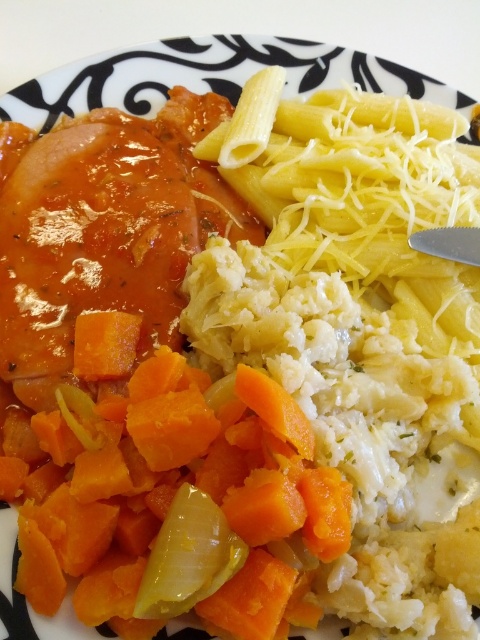
Question: Which point is farther to the camera?

Choices:
 (A) (213, 525)
 (B) (264, 589)

Answer: (A)

Question: From the image, what is the correct spatial relationship of orange smooth carrot at left in relation to yellow translucent onion at lower center?

Choices:
 (A) above
 (B) below

Answer: (A)

Question: In this image, where is orange smooth carrot at left located relative to yellow translucent onion at lower center?

Choices:
 (A) left
 (B) right

Answer: (A)

Question: Which point is farther to the camera?

Choices:
 (A) yellow translucent onion at lower center
 (B) orange smooth carrot at left

Answer: (B)

Question: Which point is farther to the camera?

Choices:
 (A) (215, 572)
 (B) (81, 518)

Answer: (B)

Question: Does orange smooth carrot at left appear on the left side of yellow translucent onion at lower center?

Choices:
 (A) no
 (B) yes

Answer: (B)